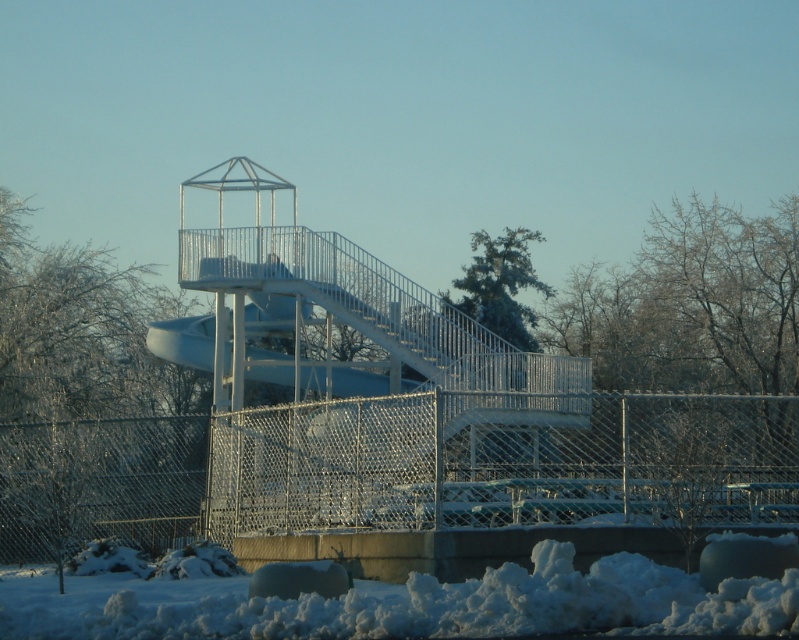
Question: Which object is farther from the camera taking this photo?

Choices:
 (A) frosty white tree at upper left
 (B) chain link fence at lower center

Answer: (A)

Question: Does chain link fence at lower center have a lesser width compared to frosty white tree at upper left?

Choices:
 (A) no
 (B) yes

Answer: (B)

Question: In this image, where is frosty white tree at upper left located relative to white fluffy snow at lower center?

Choices:
 (A) below
 (B) above

Answer: (B)

Question: Estimate the real-world distances between objects in this image. Which object is closer to the white fluffy snow at lower center?

Choices:
 (A) chain link fence at lower center
 (B) frosty white tree at upper left

Answer: (A)

Question: Considering the real-world distances, which object is closest to the chain link fence at lower center?

Choices:
 (A) white fluffy snow at lower center
 (B) frosty white tree at upper left

Answer: (B)

Question: Does chain link fence at lower center appear over white fluffy snow at lower center?

Choices:
 (A) yes
 (B) no

Answer: (A)